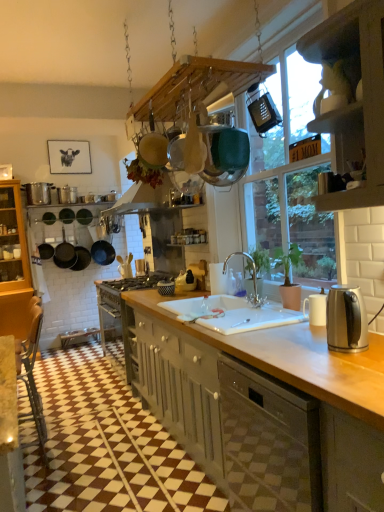
Question: From the image's perspective, is matte gray cabinetry at center, which appears as the second cabinetry when viewed from the top, below brushed metal toaster at center, acting as the 3th appliance starting from the top?

Choices:
 (A) yes
 (B) no

Answer: (A)

Question: Does matte gray cabinetry at center, the second cabinetry from the front, have a lesser height compared to brushed metal toaster at center, which appears as the second appliance when ordered from the bottom?

Choices:
 (A) yes
 (B) no

Answer: (B)

Question: Does matte gray cabinetry at center, the second cabinetry from the front, touch brushed metal toaster at center, which is counted as the 3th appliance, starting from the front?

Choices:
 (A) no
 (B) yes

Answer: (A)

Question: Does matte gray cabinetry at center, the second cabinetry from the front, appear on the left side of brushed metal toaster at center, which is counted as the 3th appliance, starting from the front?

Choices:
 (A) no
 (B) yes

Answer: (A)

Question: Considering the relative positions of matte gray cabinetry at center, arranged as the first cabinetry when ordered from the bottom, and brushed metal toaster at center, which is counted as the third appliance, starting from the right, in the image provided, is matte gray cabinetry at center, arranged as the first cabinetry when ordered from the bottom, behind brushed metal toaster at center, which is counted as the third appliance, starting from the right,?

Choices:
 (A) yes
 (B) no

Answer: (B)

Question: Does matte gray cabinetry at center, which is the 1th cabinetry from back to front, turn towards brushed metal toaster at center, which is counted as the 3th appliance, starting from the front?

Choices:
 (A) yes
 (B) no

Answer: (B)

Question: From a real-world perspective, is stainless steel kettle at right positioned over white textured window at upper center based on gravity?

Choices:
 (A) no
 (B) yes

Answer: (A)

Question: Is stainless steel kettle at right outside white textured window at upper center?

Choices:
 (A) no
 (B) yes

Answer: (B)

Question: From a real-world perspective, is stainless steel kettle at right positioned under white textured window at upper center based on gravity?

Choices:
 (A) no
 (B) yes

Answer: (B)

Question: Is stainless steel kettle at right next to white textured window at upper center and touching it?

Choices:
 (A) no
 (B) yes

Answer: (A)

Question: From the image's perspective, is stainless steel kettle at right on white textured window at upper center?

Choices:
 (A) yes
 (B) no

Answer: (B)

Question: From the image's perspective, does stainless steel kettle at right appear lower than white textured window at upper center?

Choices:
 (A) no
 (B) yes

Answer: (B)

Question: Is clear glass faucet at center next to matte gray cabinetry at center, arranged as the first cabinetry when ordered from the bottom, and touching it?

Choices:
 (A) yes
 (B) no

Answer: (B)